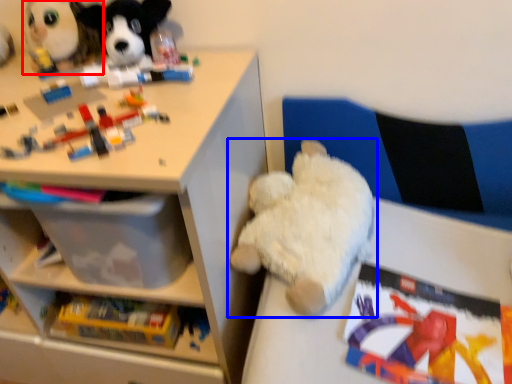
Question: Which of the following is the closest to the observer, toy (highlighted by a red box) or toy (highlighted by a blue box)?

Choices:
 (A) toy
 (B) toy

Answer: (B)